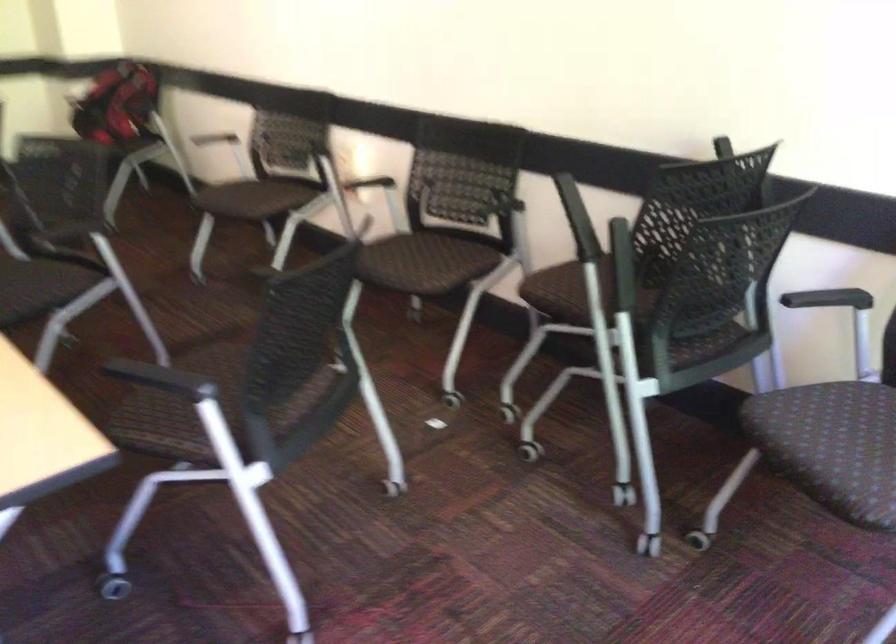
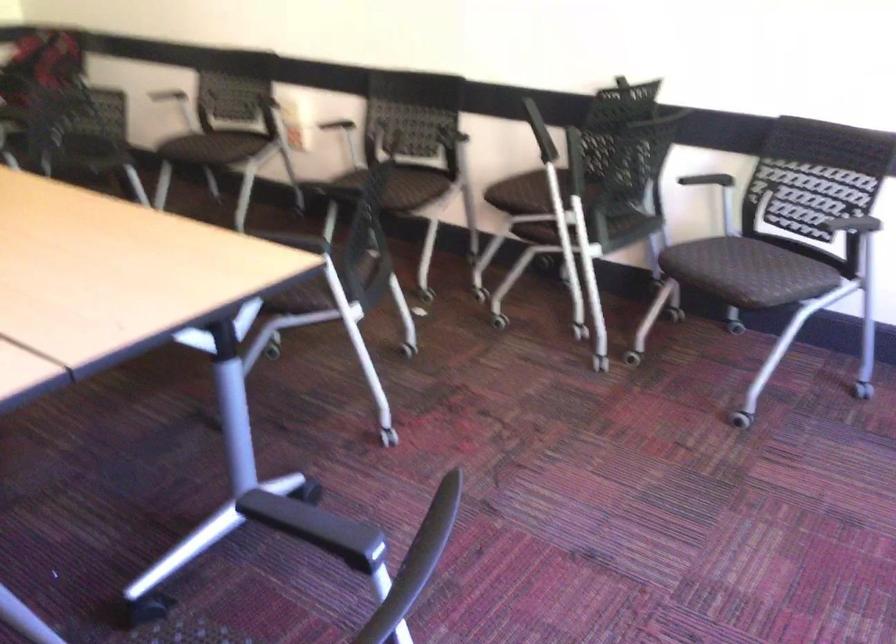
Where in the second image is the point corresponding to point 429,268 from the first image?

(402, 187)